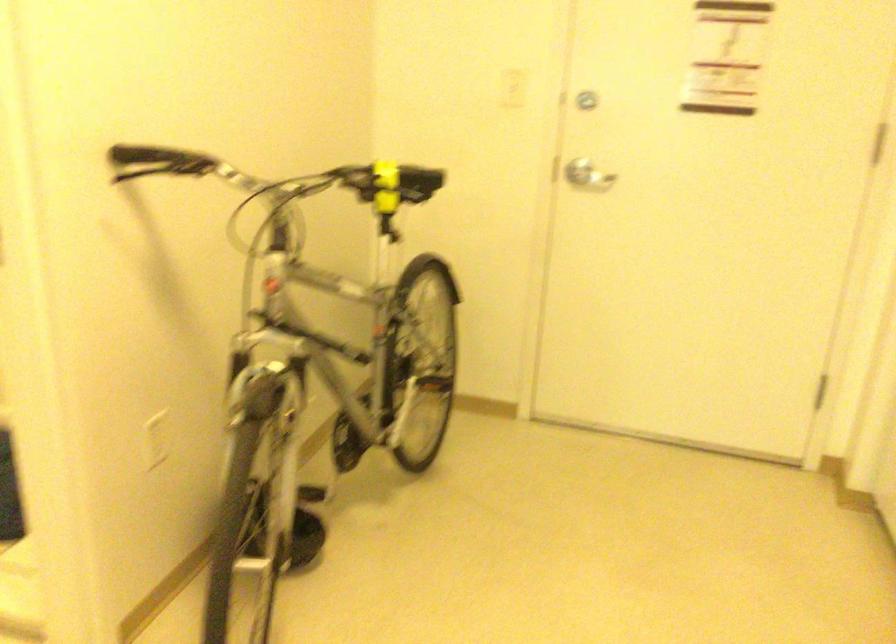
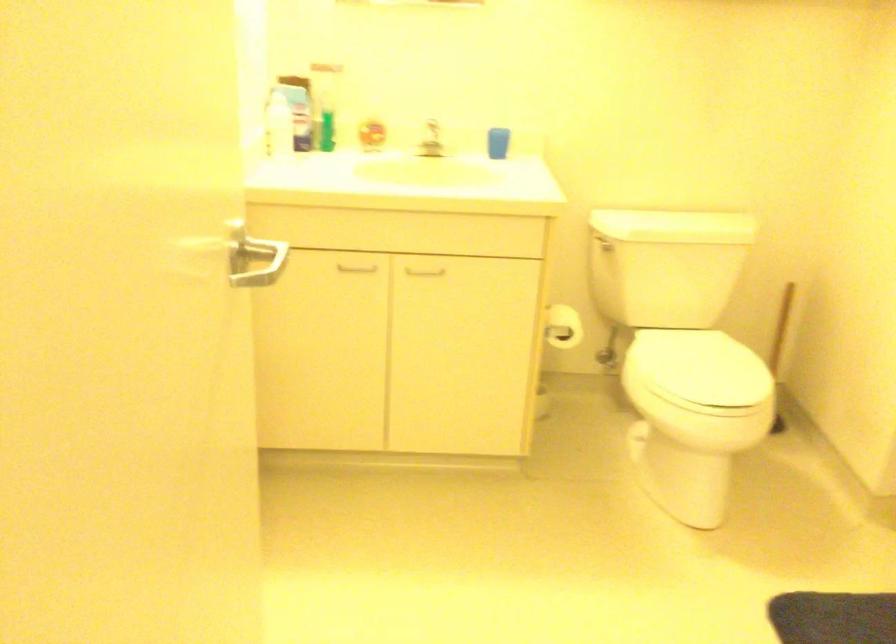
Question: The camera is either moving clockwise (left) or counter-clockwise (right) around the object. The first image is from the beginning of the video and the second image is from the end. Is the camera moving left or right when shooting the video?

Choices:
 (A) Left
 (B) Right

Answer: (B)